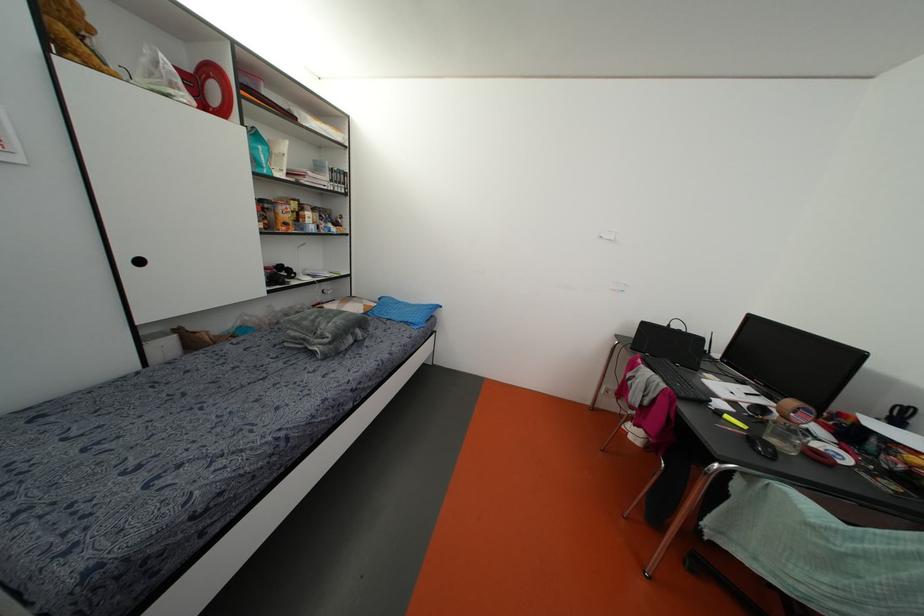
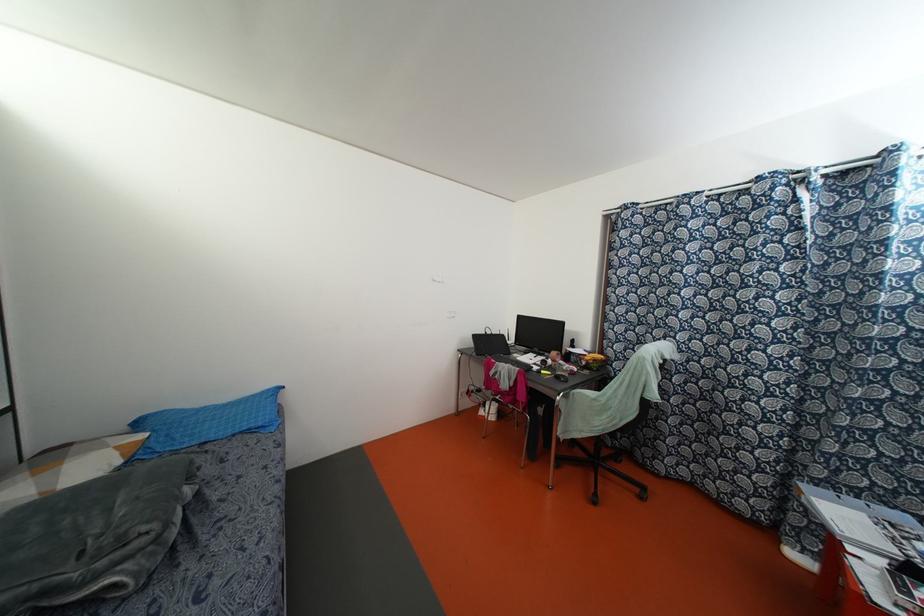
The point at [411,321] is marked in the first image. Where is the corresponding point in the second image?

(259, 424)